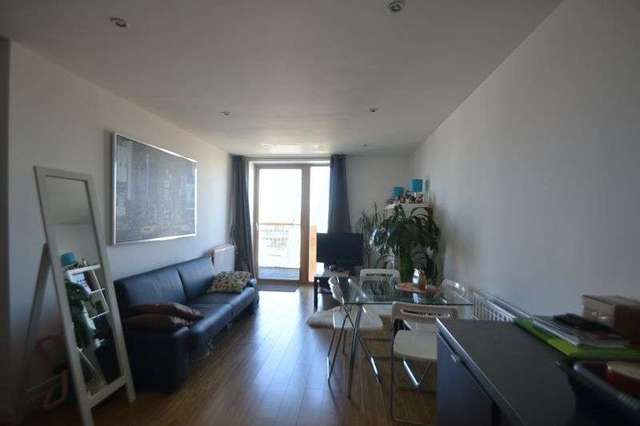
This screenshot has width=640, height=426. Find the location of `pillows`. pillows is located at coordinates (160, 306), (160, 316), (224, 281).